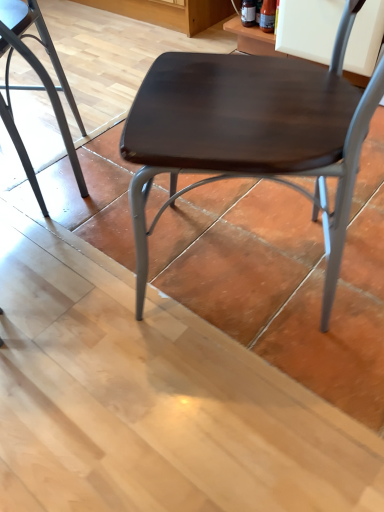
What do you see at coordinates (251, 133) in the screenshot? I see `dark wood/matte chair at center, placed as the 1th chair when sorted from right to left` at bounding box center [251, 133].

Measure the distance between dark wood/matte chair at center, acting as the second chair starting from the left, and camera.

dark wood/matte chair at center, acting as the second chair starting from the left, is 19.88 inches away from camera.

Find the location of a particular element. The width and height of the screenshot is (384, 512). dark wood/matte chair at center, placed as the 1th chair when sorted from right to left is located at coordinates (251, 133).

This screenshot has width=384, height=512. Describe the element at coordinates (36, 86) in the screenshot. I see `metallic gray chair at lower left, which appears as the 1th chair when viewed from the left` at that location.

I want to click on metallic gray chair at lower left, which appears as the 1th chair when viewed from the left, so click(36, 86).

This screenshot has height=512, width=384. What are the coordinates of `dark wood/matte chair at center, acting as the second chair starting from the left` in the screenshot? It's located at (251, 133).

Considering the positions of objects dark wood/matte chair at center, acting as the second chair starting from the left, and metallic gray chair at lower left, which appears as the 1th chair when viewed from the left, in the image provided, who is more to the left, dark wood/matte chair at center, acting as the second chair starting from the left, or metallic gray chair at lower left, which appears as the 1th chair when viewed from the left,?

From the viewer's perspective, metallic gray chair at lower left, which appears as the 1th chair when viewed from the left, appears more on the left side.

Considering the relative positions of dark wood/matte chair at center, acting as the second chair starting from the left, and metallic gray chair at lower left, which appears as the 1th chair when viewed from the left, in the image provided, is dark wood/matte chair at center, acting as the second chair starting from the left, behind metallic gray chair at lower left, which appears as the 1th chair when viewed from the left,?

No.

Which is more distant, (254, 157) or (31, 182)?

The point (31, 182) is farther.

From the image's perspective, which object appears higher, dark wood/matte chair at center, acting as the second chair starting from the left, or metallic gray chair at lower left, which ranks as the second chair in right-to-left order?

metallic gray chair at lower left, which ranks as the second chair in right-to-left order.

From a real-world perspective, is dark wood/matte chair at center, acting as the second chair starting from the left, physically below metallic gray chair at lower left, which appears as the 1th chair when viewed from the left?

No, from a real-world perspective, dark wood/matte chair at center, acting as the second chair starting from the left, is not beneath metallic gray chair at lower left, which appears as the 1th chair when viewed from the left.

In terms of width, does dark wood/matte chair at center, acting as the second chair starting from the left, look wider or thinner when compared to metallic gray chair at lower left, which ranks as the second chair in right-to-left order?

Clearly, dark wood/matte chair at center, acting as the second chair starting from the left, has more width compared to metallic gray chair at lower left, which ranks as the second chair in right-to-left order.

Which of these two, dark wood/matte chair at center, placed as the 1th chair when sorted from right to left, or metallic gray chair at lower left, which ranks as the second chair in right-to-left order, stands taller?

With more height is dark wood/matte chair at center, placed as the 1th chair when sorted from right to left.

Looking at the image, does dark wood/matte chair at center, acting as the second chair starting from the left, seem bigger or smaller compared to metallic gray chair at lower left, which appears as the 1th chair when viewed from the left?

dark wood/matte chair at center, acting as the second chair starting from the left, is bigger than metallic gray chair at lower left, which appears as the 1th chair when viewed from the left.

Is dark wood/matte chair at center, placed as the 1th chair when sorted from right to left, completely or partially outside of metallic gray chair at lower left, which ranks as the second chair in right-to-left order?

That's correct, dark wood/matte chair at center, placed as the 1th chair when sorted from right to left, is outside of metallic gray chair at lower left, which ranks as the second chair in right-to-left order.

Is dark wood/matte chair at center, acting as the second chair starting from the left, in contact with metallic gray chair at lower left, which ranks as the second chair in right-to-left order?

No, dark wood/matte chair at center, acting as the second chair starting from the left, is not making contact with metallic gray chair at lower left, which ranks as the second chair in right-to-left order.

Is dark wood/matte chair at center, acting as the second chair starting from the left, facing away from metallic gray chair at lower left, which appears as the 1th chair when viewed from the left?

That's not correct — dark wood/matte chair at center, acting as the second chair starting from the left, is not looking away from metallic gray chair at lower left, which appears as the 1th chair when viewed from the left.

How many degrees apart are the facing directions of dark wood/matte chair at center, placed as the 1th chair when sorted from right to left, and metallic gray chair at lower left, which ranks as the second chair in right-to-left order?

The facing directions of dark wood/matte chair at center, placed as the 1th chair when sorted from right to left, and metallic gray chair at lower left, which ranks as the second chair in right-to-left order, are 86.6 degrees apart.

Measure the distance from dark wood/matte chair at center, acting as the second chair starting from the left, to metallic gray chair at lower left, which appears as the 1th chair when viewed from the left.

dark wood/matte chair at center, acting as the second chair starting from the left, and metallic gray chair at lower left, which appears as the 1th chair when viewed from the left, are 55.61 centimeters apart from each other.

What are the coordinates of `chair in front of the metallic gray chair at lower left, which ranks as the second chair in right-to-left order` in the screenshot? It's located at (251, 133).

Looking at this image, based on their positions, is metallic gray chair at lower left, which appears as the 1th chair when viewed from the left, located to the left or right of dark wood/matte chair at center, placed as the 1th chair when sorted from right to left?

Based on their positions, metallic gray chair at lower left, which appears as the 1th chair when viewed from the left, is located to the left of dark wood/matte chair at center, placed as the 1th chair when sorted from right to left.

Considering the positions of objects metallic gray chair at lower left, which ranks as the second chair in right-to-left order, and dark wood/matte chair at center, placed as the 1th chair when sorted from right to left, in the image provided, who is behind, metallic gray chair at lower left, which ranks as the second chair in right-to-left order, or dark wood/matte chair at center, placed as the 1th chair when sorted from right to left,?

metallic gray chair at lower left, which ranks as the second chair in right-to-left order, is behind.

Does point (55, 64) appear closer or farther from the camera than point (228, 159)?

Point (55, 64) is positioned farther from the camera compared to point (228, 159).

Based on the photo, from the image's perspective, is metallic gray chair at lower left, which appears as the 1th chair when viewed from the left, over dark wood/matte chair at center, acting as the second chair starting from the left?

Yes, from the image's perspective, metallic gray chair at lower left, which appears as the 1th chair when viewed from the left, is on top of dark wood/matte chair at center, acting as the second chair starting from the left.

From the picture: From a real-world perspective, is metallic gray chair at lower left, which appears as the 1th chair when viewed from the left, above or below dark wood/matte chair at center, placed as the 1th chair when sorted from right to left?

metallic gray chair at lower left, which appears as the 1th chair when viewed from the left, is below dark wood/matte chair at center, placed as the 1th chair when sorted from right to left.

Considering the sizes of metallic gray chair at lower left, which ranks as the second chair in right-to-left order, and dark wood/matte chair at center, acting as the second chair starting from the left, in the image, is metallic gray chair at lower left, which ranks as the second chair in right-to-left order, wider or thinner than dark wood/matte chair at center, acting as the second chair starting from the left,?

Clearly, metallic gray chair at lower left, which ranks as the second chair in right-to-left order, has less width compared to dark wood/matte chair at center, acting as the second chair starting from the left.

Considering the relative sizes of metallic gray chair at lower left, which ranks as the second chair in right-to-left order, and dark wood/matte chair at center, placed as the 1th chair when sorted from right to left, in the image provided, is metallic gray chair at lower left, which ranks as the second chair in right-to-left order, shorter than dark wood/matte chair at center, placed as the 1th chair when sorted from right to left,?

Yes.

Based on their sizes in the image, would you say metallic gray chair at lower left, which ranks as the second chair in right-to-left order, is bigger or smaller than dark wood/matte chair at center, placed as the 1th chair when sorted from right to left?

Considering their sizes, metallic gray chair at lower left, which ranks as the second chair in right-to-left order, takes up less space than dark wood/matte chair at center, placed as the 1th chair when sorted from right to left.

Is metallic gray chair at lower left, which appears as the 1th chair when viewed from the left, surrounding dark wood/matte chair at center, placed as the 1th chair when sorted from right to left?

No, dark wood/matte chair at center, placed as the 1th chair when sorted from right to left, is not inside metallic gray chair at lower left, which appears as the 1th chair when viewed from the left.

Is metallic gray chair at lower left, which ranks as the second chair in right-to-left order, next to dark wood/matte chair at center, placed as the 1th chair when sorted from right to left, and touching it?

No, metallic gray chair at lower left, which ranks as the second chair in right-to-left order, is not with dark wood/matte chair at center, placed as the 1th chair when sorted from right to left.

Could you tell me if metallic gray chair at lower left, which appears as the 1th chair when viewed from the left, is turned towards dark wood/matte chair at center, acting as the second chair starting from the left?

No.

How many degrees apart are the facing directions of metallic gray chair at lower left, which ranks as the second chair in right-to-left order, and dark wood/matte chair at center, placed as the 1th chair when sorted from right to left?

86.6 degrees separate the facing orientations of metallic gray chair at lower left, which ranks as the second chair in right-to-left order, and dark wood/matte chair at center, placed as the 1th chair when sorted from right to left.

Where is `chair lying on the right of metallic gray chair at lower left, which ranks as the second chair in right-to-left order`? This screenshot has width=384, height=512. chair lying on the right of metallic gray chair at lower left, which ranks as the second chair in right-to-left order is located at coordinates (251, 133).

At what (x,y) coordinates should I click in order to perform the action: click on chair below the dark wood/matte chair at center, placed as the 1th chair when sorted from right to left (from a real-world perspective). Please return your answer as a coordinate pair (x, y). This screenshot has height=512, width=384. Looking at the image, I should click on (36, 86).

Image resolution: width=384 pixels, height=512 pixels. Identify the location of chair on the left of the dark wood/matte chair at center, placed as the 1th chair when sorted from right to left. (36, 86).